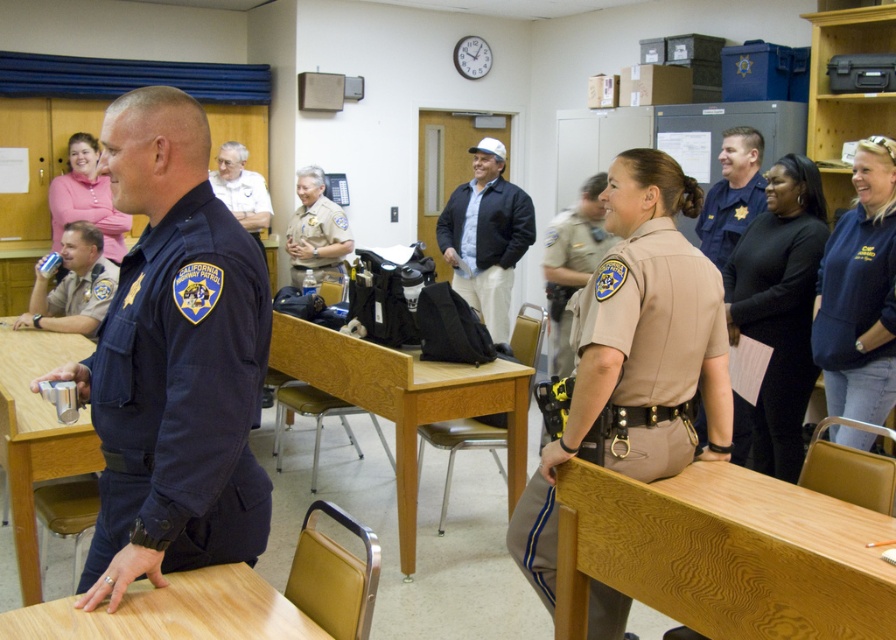
From the picture: You are a guest attending a meeting in this room and need to leave quickly. There are two exits in the room, one near the pink fleece sweater at upper left and another near the white cotton shirt at upper center. Which exit is closer to you based on their positions?

The pink fleece sweater at upper left is in front of the white cotton shirt at upper center, so the exit near the pink fleece sweater at upper left is closer to you.

You are a photographer who needs to capture a photo of the brown leather jacket at upper right without moving from your current position. The camera you are using has a maximum zoom range that can focus on objects up to 3 meters away. Can you take the photo from your current position?

The brown leather jacket at upper right and camera are 3.67 meters apart from each other. Since the maximum zoom range is 3 meters, the distance of 3.67 meters exceeds this limit, so you cannot take the photo from your current position without moving closer.